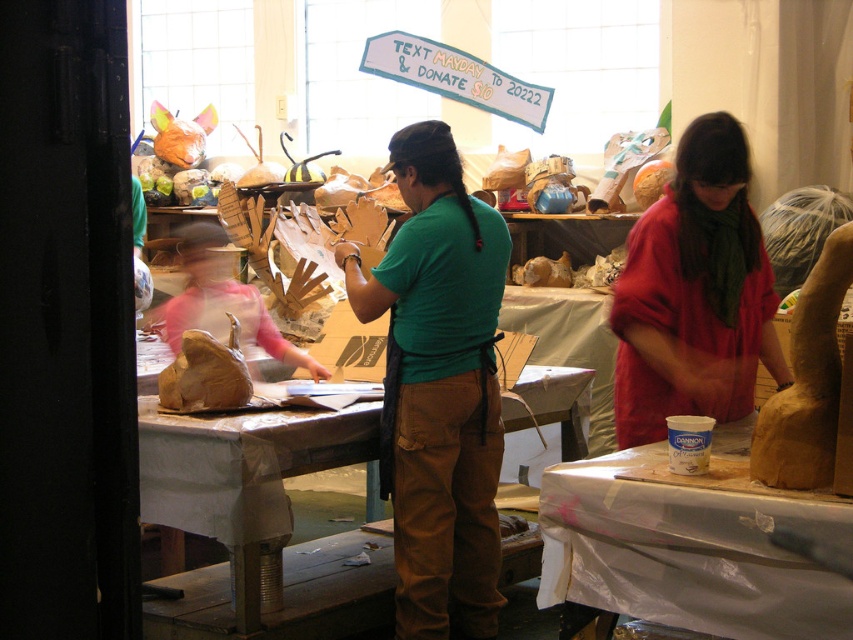
Question: Can you confirm if white plastic table at lower right is smaller than brown paper table at center?

Choices:
 (A) no
 (B) yes

Answer: (B)

Question: Which object is positioned closest to the white plastic table at lower right?

Choices:
 (A) green cotton shirt at center
 (B) matte red shirt at center
 (C) matte pink shirt at center
 (D) brown paper table at center

Answer: (B)

Question: Is matte red shirt at center behind brown paper table at center?

Choices:
 (A) yes
 (B) no

Answer: (B)

Question: Which point is farther from the camera taking this photo?

Choices:
 (A) coord(621,445)
 (B) coord(225,288)

Answer: (B)

Question: Does green cotton shirt at center appear over brown paper table at center?

Choices:
 (A) yes
 (B) no

Answer: (A)

Question: Among these points, which one is farthest from the camera?

Choices:
 (A) (173, 497)
 (B) (393, 273)
 (C) (824, 592)

Answer: (A)